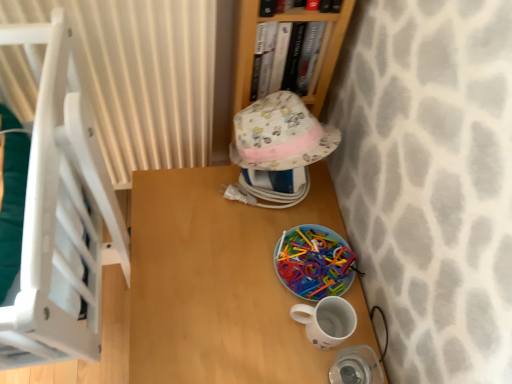
Question: Is wooden bookshelf at upper center situated inside fluffy cotton hat at center or outside?

Choices:
 (A) outside
 (B) inside

Answer: (A)

Question: Is point (248, 38) closer or farther from the camera than point (256, 125)?

Choices:
 (A) farther
 (B) closer

Answer: (B)

Question: Based on their relative distances, which object is nearer to the wooden table at center?

Choices:
 (A) wooden bookshelf at upper center
 (B) white glossy mug at lower right
 (C) beige striped curtain at upper left
 (D) hardcover book at upper center
 (E) fluffy cotton hat at center

Answer: (B)

Question: Which of these objects is positioned closest to the beige striped curtain at upper left?

Choices:
 (A) wooden bookshelf at upper center
 (B) fluffy cotton hat at center
 (C) white glossy mug at lower right
 (D) wooden table at center
 (E) hardcover book at upper center

Answer: (A)